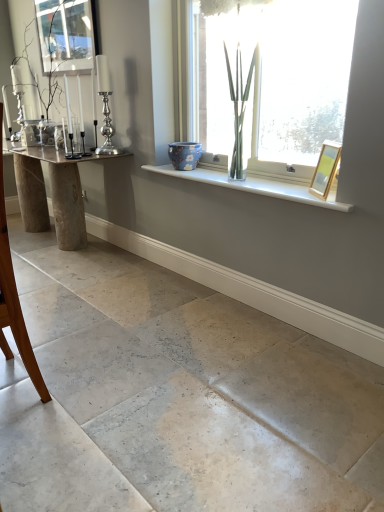
What do you see at coordinates (65, 35) in the screenshot? The image size is (384, 512). I see `clear glass window screen at upper left` at bounding box center [65, 35].

The width and height of the screenshot is (384, 512). What do you see at coordinates (325, 169) in the screenshot? I see `wooden picture frame at upper right` at bounding box center [325, 169].

This screenshot has height=512, width=384. I want to click on brown wooden chair at left, so click(x=14, y=298).

Is brown wooden chair at left oriented away from clear glass window screen at upper left?

No, brown wooden chair at left's orientation is not away from clear glass window screen at upper left.

Consider the image. From a real-world perspective, which is physically below, brown wooden chair at left or clear glass window screen at upper left?

brown wooden chair at left, from a real-world perspective.

Find the location of `window screen that appears on the left of brown wooden chair at left`. window screen that appears on the left of brown wooden chair at left is located at coordinates (65, 35).

Considering the positions of objects brown wooden chair at left and clear glass window screen at upper left in the image provided, who is in front, brown wooden chair at left or clear glass window screen at upper left?

Positioned in front is brown wooden chair at left.

Is transparent glass vase at upper center positioned before brown wooden chair at left?

No, it is not.

Does transparent glass vase at upper center contain brown wooden chair at left?

No, brown wooden chair at left is located outside of transparent glass vase at upper center.

Is point (300, 9) closer or farther from the camera than point (15, 283)?

Clearly, point (300, 9) is closer to the camera than point (15, 283).

Looking at this image, is transparent glass vase at upper center facing towards brown wooden chair at left?

Yes, transparent glass vase at upper center is aimed at brown wooden chair at left.

Is white glossy window sill at upper center inside the boundaries of clear glass vase at left, or outside?

white glossy window sill at upper center is not inside clear glass vase at left, it's outside.

Could you tell me if white glossy window sill at upper center is facing clear glass vase at left?

No, white glossy window sill at upper center is not facing towards clear glass vase at left.

Looking at their sizes, would you say white glossy window sill at upper center is wider or thinner than clear glass vase at left?

Considering their sizes, white glossy window sill at upper center looks slimmer than clear glass vase at left.

I want to click on plant located above the natural stone table at left (from a real-world perspective), so click(49, 63).

Looking at their sizes, would you say natural stone table at left is wider or thinner than clear glass vase at left?

In the image, natural stone table at left appears to be wider than clear glass vase at left.

Is natural stone table at left outside of clear glass vase at left?

Indeed, natural stone table at left is completely outside clear glass vase at left.

Considering the relative positions of natural stone table at left and clear glass vase at left in the image provided, is natural stone table at left in front of clear glass vase at left?

Yes, it is in front of clear glass vase at left.

At what (x,y) coordinates should I click in order to perform the action: click on glass vase on the left of the transparent glass vase at upper center. Please return your answer as a coordinate pair (x, y). Looking at the image, I should click on (184, 155).

Which of these two, blue glossy vase at center or transparent glass vase at upper center, is smaller?

blue glossy vase at center is smaller.

From a real-world perspective, is blue glossy vase at center positioned under transparent glass vase at upper center based on gravity?

Yes, from a real-world perspective, blue glossy vase at center is under transparent glass vase at upper center.

From the image's perspective, is blue glossy vase at center below transparent glass vase at upper center?

Yes, from the image's perspective, blue glossy vase at center is below transparent glass vase at upper center.

Which is correct: white glossy window sill at upper center is inside wooden picture frame at upper right, or outside of it?

The correct answer is: outside.

Which object is wider, white glossy window sill at upper center or wooden picture frame at upper right?

With larger width is white glossy window sill at upper center.

Is white glossy window sill at upper center aimed at wooden picture frame at upper right?

No.

Identify the location of window sill that appears above the wooden picture frame at upper right (from the image's perspective). The image size is (384, 512). (254, 185).

Who is smaller, wooden picture frame at upper right or clear glass vase at left?

wooden picture frame at upper right.

From their relative heights in the image, would you say wooden picture frame at upper right is taller or shorter than clear glass vase at left?

wooden picture frame at upper right is shorter than clear glass vase at left.

Is wooden picture frame at upper right to the left or to the right of clear glass vase at left in the image?

wooden picture frame at upper right is to the right of clear glass vase at left.

Looking at this image, choose the correct answer: Is wooden picture frame at upper right inside clear glass vase at left or outside it?

wooden picture frame at upper right lies outside clear glass vase at left.

Find the location of a particular element. armchair in front of the clear glass window screen at upper left is located at coordinates (14, 298).

Image resolution: width=384 pixels, height=512 pixels. In order to click on window behind the brown wooden chair at left in this screenshot , I will do `click(296, 83)`.

Considering their positions, is natural stone table at left positioned further to transparent glass vase at upper center than brown wooden chair at left?

brown wooden chair at left.

From the image, which object appears to be farther from blue glossy vase at center, clear glass vase at left or white glossy window sill at upper center?

The object further to blue glossy vase at center is clear glass vase at left.

Based on the photo, estimate the real-world distances between objects in this image. Which object is closer to transparent glass vase at upper center, brown wooden chair at left or natural stone table at left?

natural stone table at left.

When comparing their distances from clear glass window screen at upper left, does blue glossy vase at center or wooden picture frame at upper right seem closer?

Among the two, blue glossy vase at center is located nearer to clear glass window screen at upper left.

Looking at the image, which one is located closer to blue glossy vase at center, brown wooden chair at left or wooden picture frame at upper right?

Based on the image, wooden picture frame at upper right appears to be nearer to blue glossy vase at center.

When comparing their distances from transparent glass vase at upper center, does natural stone table at left or clear glass vase at left seem further?

Among the two, clear glass vase at left is located further to transparent glass vase at upper center.

Considering their positions, is natural stone table at left positioned further to blue glossy vase at center than brown wooden chair at left?

brown wooden chair at left is positioned further to the anchor blue glossy vase at center.

Based on their spatial positions, is transparent glass vase at upper center or clear glass window screen at upper left closer to brown wooden chair at left?

The object closer to brown wooden chair at left is transparent glass vase at upper center.

Where is `window screen between natural stone table at left and wooden picture frame at upper right`? The image size is (384, 512). window screen between natural stone table at left and wooden picture frame at upper right is located at coordinates (65, 35).

Find the location of a particular element. table between brown wooden chair at left and clear glass window screen at upper left along the z-axis is located at coordinates (53, 194).

Image resolution: width=384 pixels, height=512 pixels. In order to click on window sill between brown wooden chair at left and blue glossy vase at center from front to back in this screenshot , I will do `click(254, 185)`.

This screenshot has height=512, width=384. I want to click on window sill located between clear glass vase at left and wooden picture frame at upper right in the left-right direction, so click(x=254, y=185).